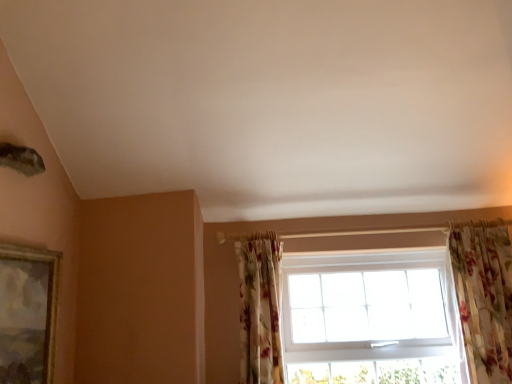
Question: From the image's perspective, is white plastic window at center above gold-framed painting at left?

Choices:
 (A) no
 (B) yes

Answer: (A)

Question: From a real-world perspective, is white plastic window at center under gold-framed painting at left?

Choices:
 (A) yes
 (B) no

Answer: (A)

Question: Does white plastic window at center appear on the right side of gold-framed painting at left?

Choices:
 (A) no
 (B) yes

Answer: (B)

Question: Is white plastic window at center positioned beyond the bounds of gold-framed painting at left?

Choices:
 (A) yes
 (B) no

Answer: (A)

Question: Is white plastic window at center facing towards gold-framed painting at left?

Choices:
 (A) yes
 (B) no

Answer: (B)

Question: From a real-world perspective, relative to gold-framed painting at left, is white plastic window at center vertically above or below?

Choices:
 (A) above
 (B) below

Answer: (B)

Question: Is point (328, 316) closer or farther from the camera than point (24, 347)?

Choices:
 (A) closer
 (B) farther

Answer: (B)

Question: Is white plastic window at center taller or shorter than gold-framed painting at left?

Choices:
 (A) tall
 (B) short

Answer: (A)

Question: In terms of width, does white plastic window at center look wider or thinner when compared to gold-framed painting at left?

Choices:
 (A) wide
 (B) thin

Answer: (B)

Question: In the image, is white plastic window at center on the left side or the right side of floral fabric curtain at right, the 1th curtain in the right-to-left sequence?

Choices:
 (A) left
 (B) right

Answer: (A)

Question: Is white plastic window at center inside or outside of floral fabric curtain at right, acting as the second curtain starting from the left?

Choices:
 (A) inside
 (B) outside

Answer: (B)

Question: Looking at their shapes, would you say white plastic window at center is wider or thinner than floral fabric curtain at right, acting as the second curtain starting from the left?

Choices:
 (A) thin
 (B) wide

Answer: (A)

Question: Is point (379, 317) closer or farther from the camera than point (496, 360)?

Choices:
 (A) farther
 (B) closer

Answer: (A)

Question: Is floral fabric curtain at lower right, which is counted as the first curtain, starting from the left, wider or thinner than white plastic window at center?

Choices:
 (A) wide
 (B) thin

Answer: (A)

Question: Considering their positions, is floral fabric curtain at lower right, which is counted as the first curtain, starting from the left, located in front of or behind white plastic window at center?

Choices:
 (A) front
 (B) behind

Answer: (A)